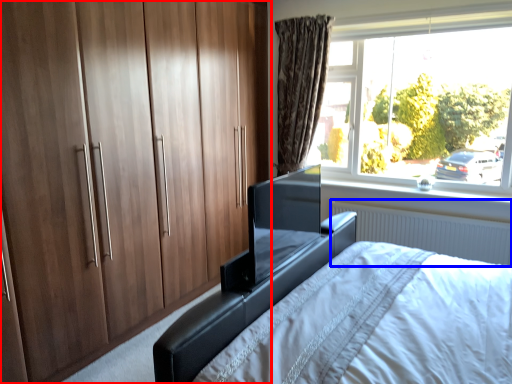
Question: Which object is closer to the camera taking this photo, cupboard (highlighted by a red box) or radiator (highlighted by a blue box)?

Choices:
 (A) cupboard
 (B) radiator

Answer: (A)